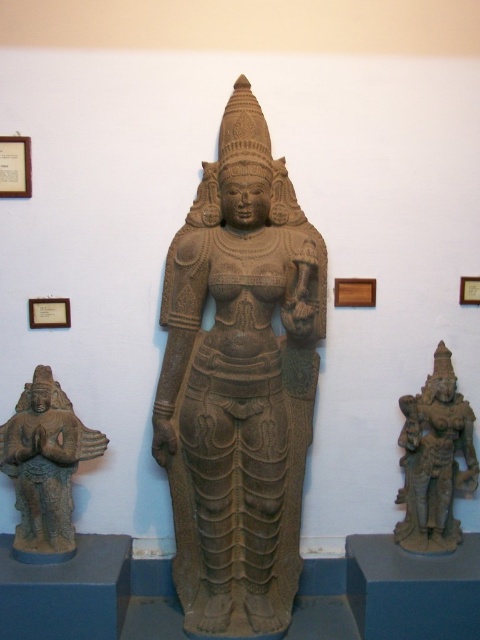
Can you confirm if brown stone statue at lower left is taller than brown stone statue at lower right?

In fact, brown stone statue at lower left may be shorter than brown stone statue at lower right.

Does brown stone statue at lower left have a greater width compared to brown stone statue at lower right?

Yes, brown stone statue at lower left is wider than brown stone statue at lower right.

The width and height of the screenshot is (480, 640). Describe the element at coordinates (45, 467) in the screenshot. I see `brown stone statue at lower left` at that location.

The height and width of the screenshot is (640, 480). In order to click on brown stone statue at lower left in this screenshot , I will do `click(45, 467)`.

Between brown stone statue at center and brown stone statue at lower left, which one is positioned lower?

brown stone statue at lower left

Who is more forward, (192, 573) or (72, 532)?

Point (192, 573) is more forward.

Identify the location of brown stone statue at center. [x=240, y=381].

Identify the location of brown stone statue at center. This screenshot has width=480, height=640. (240, 381).

Is brown stone statue at center thinner than brown stone statue at lower right?

No, brown stone statue at center is not thinner than brown stone statue at lower right.

Is brown stone statue at center to the left of brown stone statue at lower right from the viewer's perspective?

Yes, brown stone statue at center is to the left of brown stone statue at lower right.

At what (x,y) coordinates should I click in order to perform the action: click on brown stone statue at center. Please return your answer as a coordinate pair (x, y). The image size is (480, 640). Looking at the image, I should click on (240, 381).